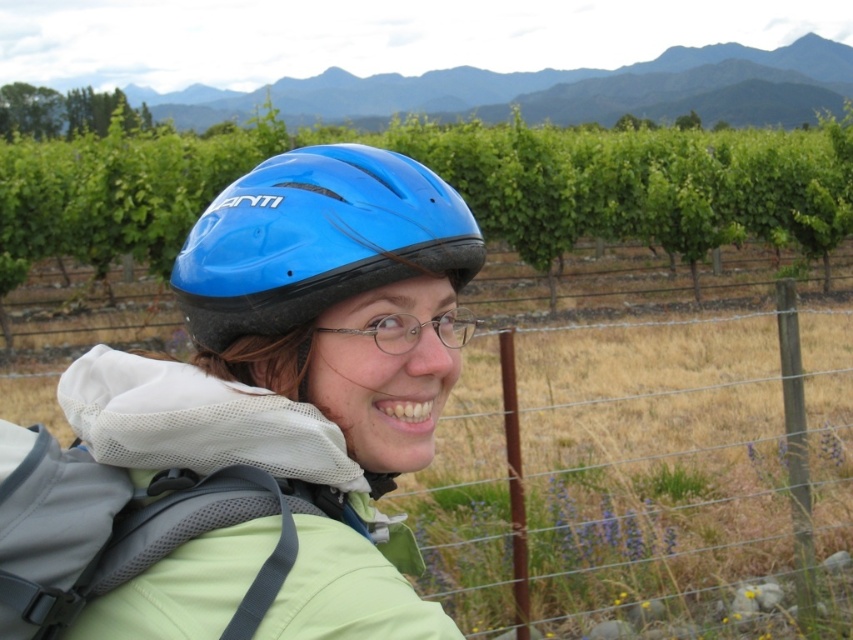
Question: Where is blue matte helmet at center located in relation to blue matte bicycle helmet at center in the image?

Choices:
 (A) above
 (B) below

Answer: (B)

Question: Which of the following is the farthest from the observer?

Choices:
 (A) (270, 177)
 (B) (697, 376)
 (C) (437, 627)

Answer: (B)

Question: Which point is closer to the camera?

Choices:
 (A) (102, 604)
 (B) (413, 262)

Answer: (A)

Question: Which point is closer to the camera?

Choices:
 (A) wire mesh fence at center
 (B) clear plastic glasses at center
 (C) blue matte bicycle helmet at center
 (D) blue matte helmet at center

Answer: (D)

Question: Can you confirm if blue matte bicycle helmet at center is positioned to the left of clear plastic glasses at center?

Choices:
 (A) yes
 (B) no

Answer: (A)

Question: Can you confirm if blue matte helmet at center is positioned above blue matte bicycle helmet at center?

Choices:
 (A) yes
 (B) no

Answer: (B)